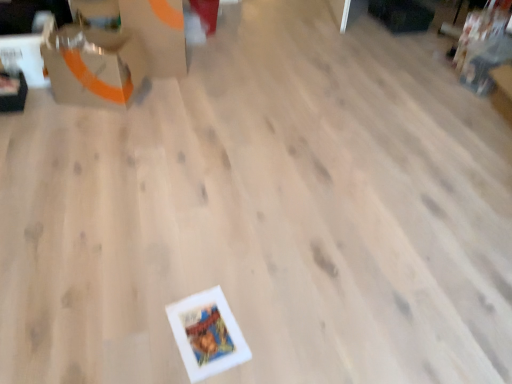
Question: From a real-world perspective, is matte cardboard box at upper left, the second cardboard box positioned from the top, above or below matte orange cardboard box at upper left, placed as the 1th cardboard box when sorted from top to bottom?

Choices:
 (A) above
 (B) below

Answer: (B)

Question: Visually, is matte cardboard box at upper left, the second cardboard box positioned from the top, positioned to the left or to the right of matte orange cardboard box at upper left, which is the 2th cardboard box from bottom to top?

Choices:
 (A) left
 (B) right

Answer: (A)

Question: Based on their sizes in the image, would you say matte cardboard box at upper left, the second cardboard box positioned from the top, is bigger or smaller than matte orange cardboard box at upper left, placed as the 1th cardboard box when sorted from top to bottom?

Choices:
 (A) small
 (B) big

Answer: (A)

Question: From a real-world perspective, is matte orange cardboard box at upper left, placed as the 1th cardboard box when sorted from top to bottom, physically located above or below matte cardboard box at upper left, which is the 1th cardboard box in bottom-to-top order?

Choices:
 (A) above
 (B) below

Answer: (A)

Question: Considering the positions of point (175, 39) and point (120, 64), is point (175, 39) closer or farther from the camera than point (120, 64)?

Choices:
 (A) farther
 (B) closer

Answer: (A)

Question: In terms of width, does matte orange cardboard box at upper left, which is the 2th cardboard box from bottom to top, look wider or thinner when compared to matte cardboard box at upper left, which is the 1th cardboard box in bottom-to-top order?

Choices:
 (A) wide
 (B) thin

Answer: (A)

Question: In terms of size, does matte orange cardboard box at upper left, which is the 2th cardboard box from bottom to top, appear bigger or smaller than matte cardboard box at upper left, which is the 1th cardboard box in bottom-to-top order?

Choices:
 (A) small
 (B) big

Answer: (B)